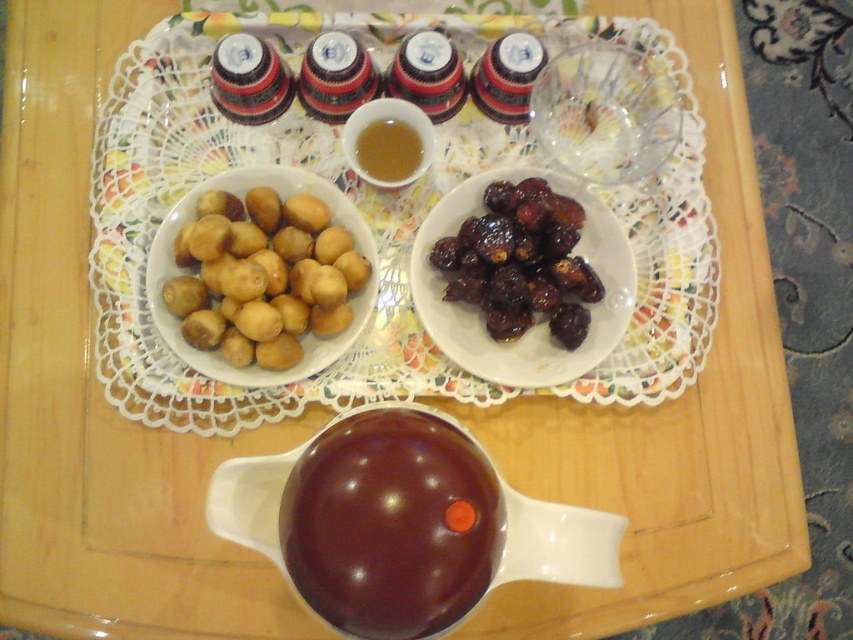
Question: Based on their relative distances, which object is farther from the shiny dark brown dates at center right?

Choices:
 (A) golden matte potatoes at left
 (B) white ceramic platter at center
 (C) shiny brown bowl at center

Answer: (C)

Question: Which of the following is the farthest from the observer?

Choices:
 (A) shiny brown bowl at center
 (B) shiny dark brown dates at center right
 (C) golden matte potatoes at left

Answer: (B)

Question: Does shiny brown bowl at center have a larger size compared to shiny dark brown dates at center right?

Choices:
 (A) yes
 (B) no

Answer: (B)

Question: Can you confirm if white ceramic platter at center is wider than shiny dark brown dates at center right?

Choices:
 (A) no
 (B) yes

Answer: (B)

Question: Among these points, which one is nearest to the camera?

Choices:
 (A) (602, 294)
 (B) (331, 305)
 (C) (685, 332)

Answer: (B)

Question: Can you confirm if golden matte potatoes at left is smaller than shiny dark brown dates at center right?

Choices:
 (A) no
 (B) yes

Answer: (A)